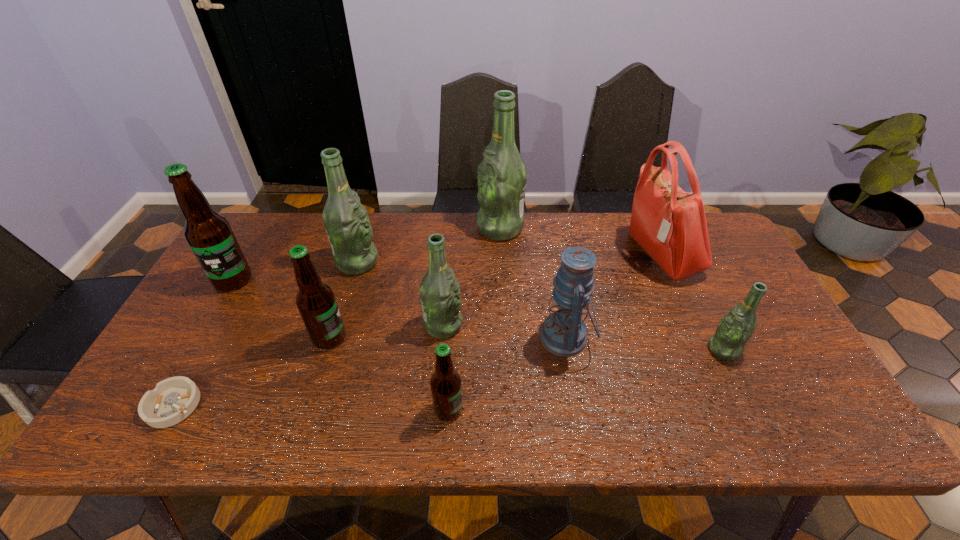
Locate an element on the screen. This screenshot has height=540, width=960. beer bottle situated at the right edge is located at coordinates (736, 327).

Locate an element on the screen. The width and height of the screenshot is (960, 540). object that is at the near left corner is located at coordinates (172, 400).

The height and width of the screenshot is (540, 960). In order to click on object present at the far right corner in this screenshot , I will do `click(670, 224)`.

In the image, there is a desktop. Identify the location of free space at the far edge. (595, 245).

What are the coordinates of `vacant space at the near edge of the desktop` in the screenshot? It's located at (555, 422).

In the image, there is a desktop. In order to click on free region at the right edge in this screenshot , I will do [716, 285].

At what (x,y) coordinates should I click in order to perform the action: click on vacant space at the near left corner of the desktop. Please return your answer as a coordinate pair (x, y). This screenshot has height=540, width=960. Looking at the image, I should click on (187, 432).

What are the coordinates of `unoccupied area between the handbag and the third green beer bottle from left to right` in the screenshot? It's located at (580, 241).

Identify the location of free space between the nearest beer bottle and the smallest green beer bottle. The image size is (960, 540). (586, 380).

Find the location of a particular element. The image size is (960, 540). vacant space that is in between the leftmost beer bottle and the rightmost beer bottle is located at coordinates (478, 315).